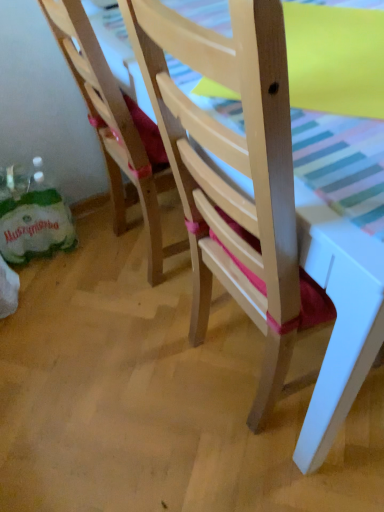
The height and width of the screenshot is (512, 384). In order to click on free space in front of wooden chair at lower left, the second chair when ordered from right to left in this screenshot , I will do `click(137, 322)`.